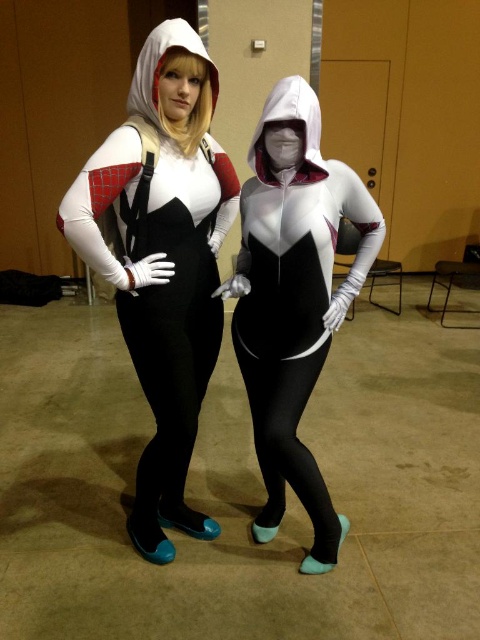
Which is behind, point (266, 314) or point (290, 225)?

Point (266, 314)

Which is in front, point (346, 301) or point (330, 186)?

Positioned in front is point (330, 186).

Measure the distance between matte white bodysuit at center and camera.

matte white bodysuit at center is 1.48 meters away from camera.

Identify the location of matte white bodysuit at center. The width and height of the screenshot is (480, 640). (294, 298).